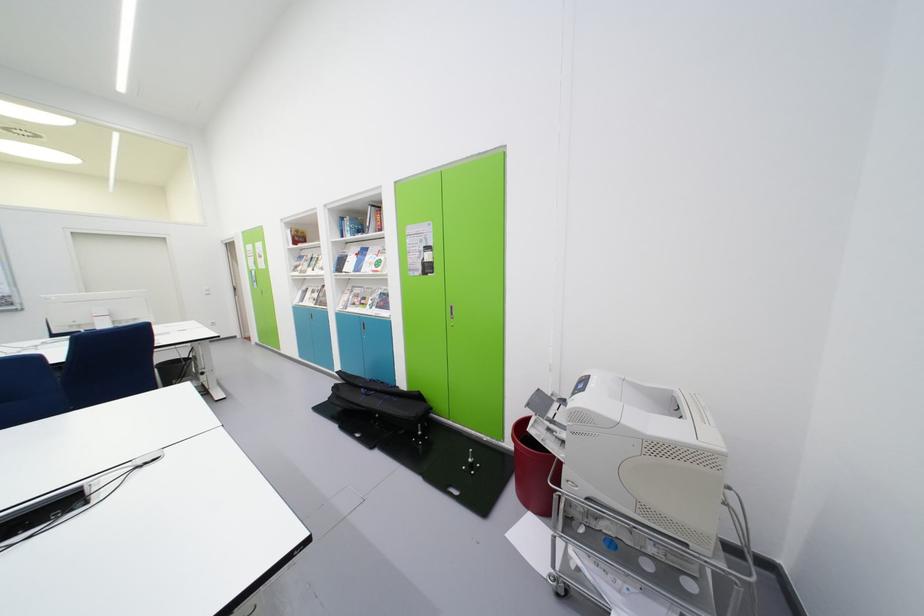
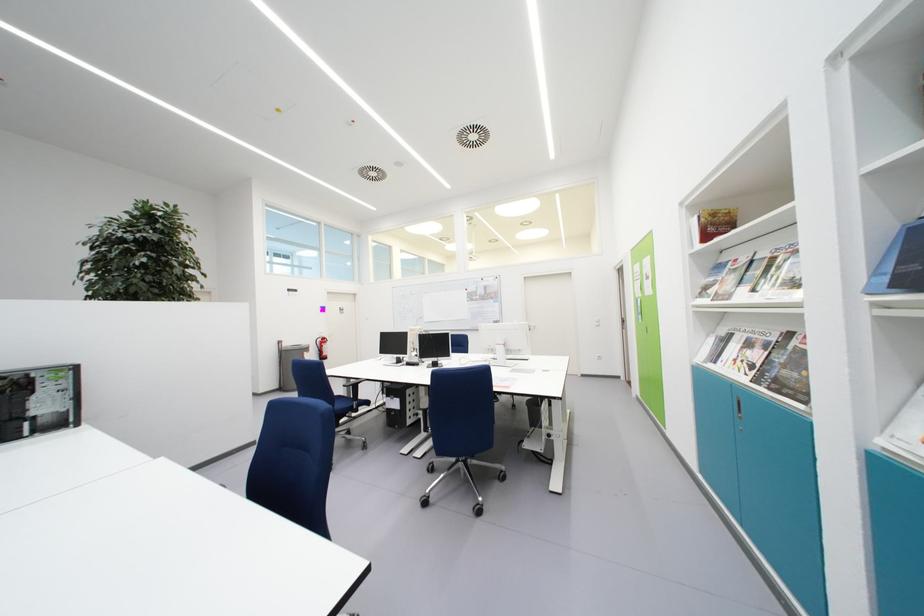
Where in the second image is the point corresponding to point 320,296 from the first image?

(755, 349)